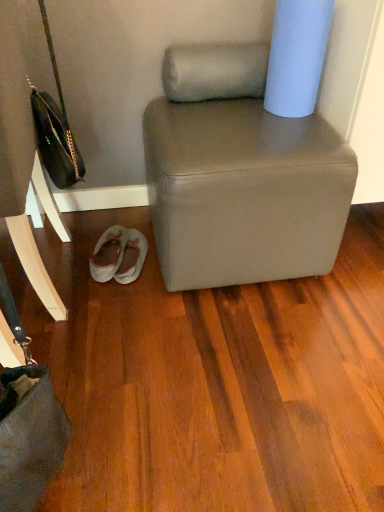
Question: Relative to matte gray ottoman at center, is light blue matte toilet paper at upper right in front or behind?

Choices:
 (A) front
 (B) behind

Answer: (B)

Question: In terms of width, does light blue matte toilet paper at upper right look wider or thinner when compared to matte gray ottoman at center?

Choices:
 (A) wide
 (B) thin

Answer: (B)

Question: Estimate the real-world distances between objects in this image. Which object is farther from the light blue matte toilet paper at upper right?

Choices:
 (A) leather handbag at left
 (B) light gray suede slippers at lower left
 (C) matte black handbag at left
 (D) matte gray ottoman at center

Answer: (A)

Question: Which object is the closest to the leather handbag at left?

Choices:
 (A) matte gray ottoman at center
 (B) light blue matte toilet paper at upper right
 (C) light gray suede slippers at lower left
 (D) matte black handbag at left

Answer: (D)